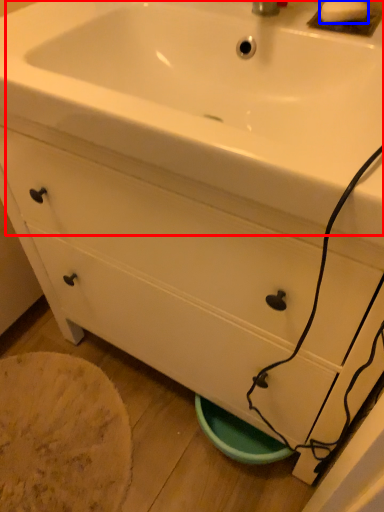
Question: Among these objects, which one is nearest to the camera, sink (highlighted by a red box) or soap (highlighted by a blue box)?

Choices:
 (A) sink
 (B) soap

Answer: (A)